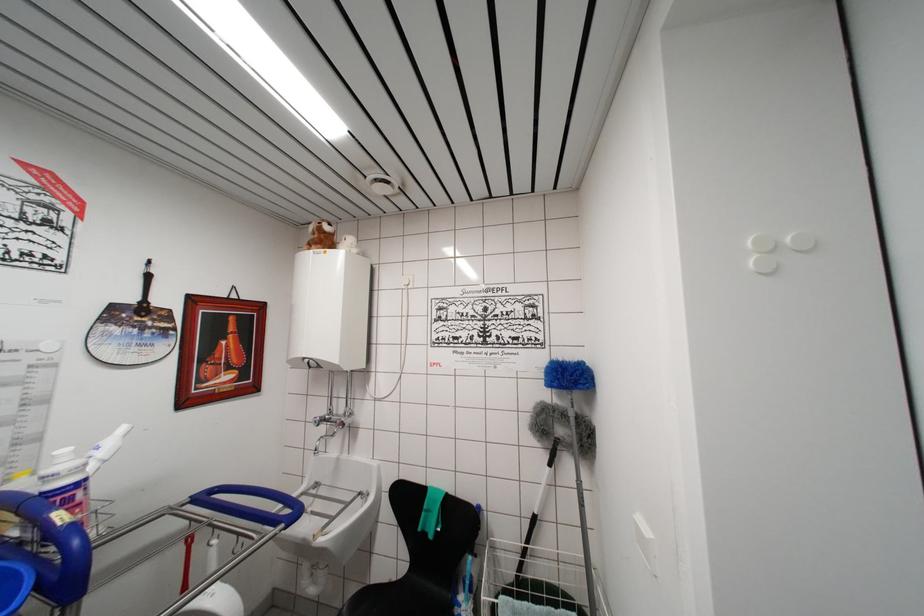
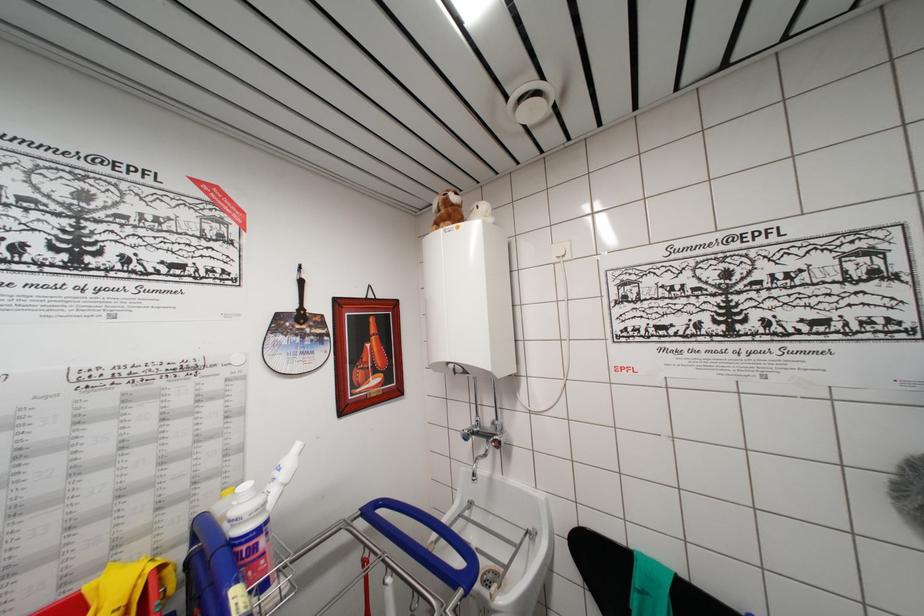
Question: The first image is from the beginning of the video and the second image is from the end. How did the camera likely rotate when shooting the video?

Choices:
 (A) Left
 (B) Right
 (C) Up
 (D) Down

Answer: (A)